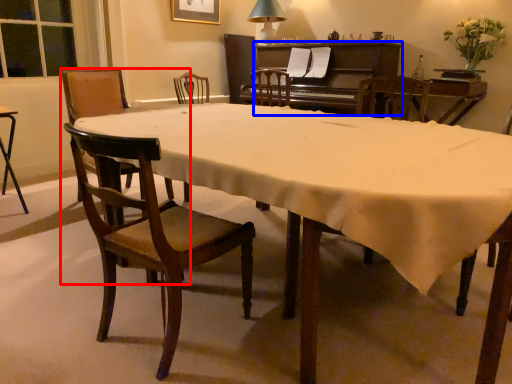
Question: Which point is further to the camera, chair (highlighted by a red box) or piano (highlighted by a blue box)?

Choices:
 (A) chair
 (B) piano

Answer: (B)